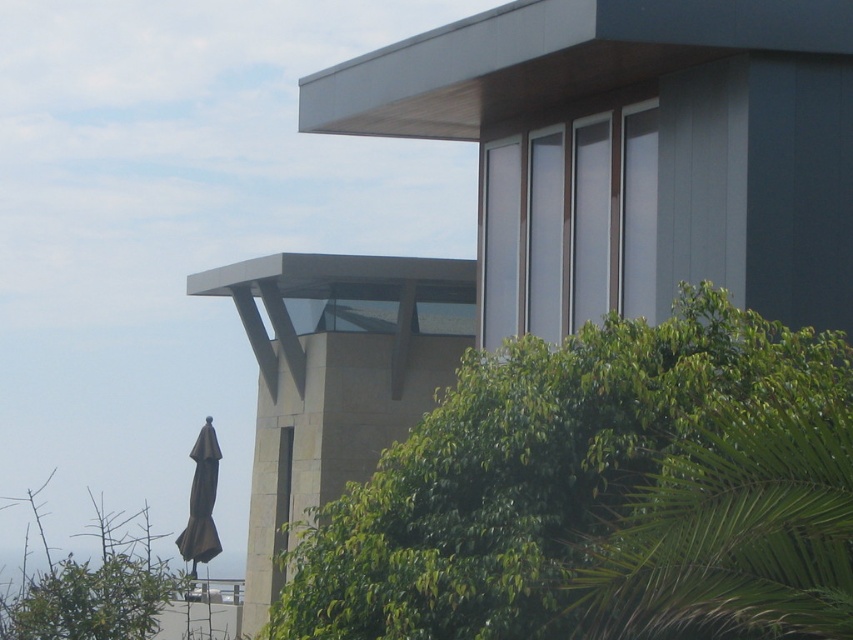
Looking at this image, you are planning to place a small bench between the green leafy tree at center and the brown matte umbrella at lower left. Based on their positions, will the bench be under the umbrella or under the tree?

The green leafy tree at center is above the brown matte umbrella at lower left, so placing the bench between them would position it under the tree since the tree is higher up.